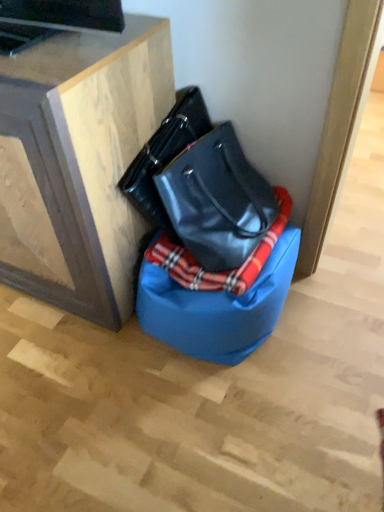
At what (x,y) coordinates should I click in order to perform the action: click on free spot in front of blue fabric bean bag chair at lower center. Please return your answer as a coordinate pair (x, y). Looking at the image, I should click on (226, 430).